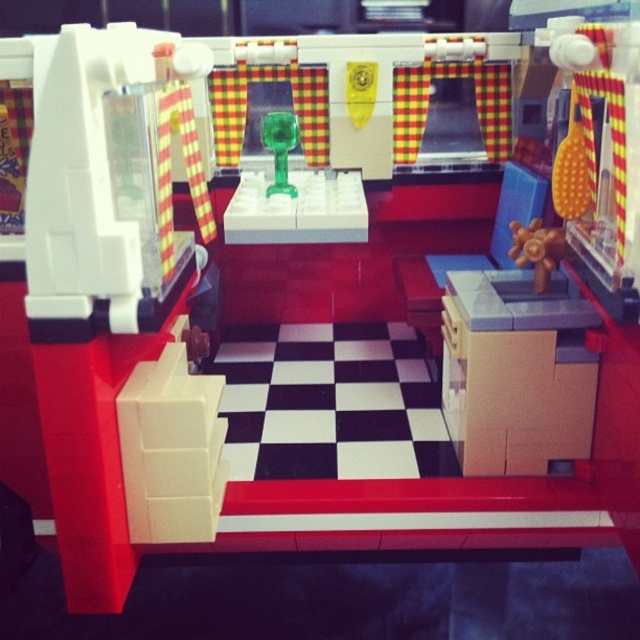
Does wooden fan at center right have a lesser height compared to green translucent plastic cup at center?

Correct, wooden fan at center right is not as tall as green translucent plastic cup at center.

Can you confirm if wooden fan at center right is positioned below green translucent plastic cup at center?

Correct, wooden fan at center right is located below green translucent plastic cup at center.

Image resolution: width=640 pixels, height=640 pixels. What do you see at coordinates (536, 250) in the screenshot?
I see `wooden fan at center right` at bounding box center [536, 250].

Locate an element on the screen. The width and height of the screenshot is (640, 640). wooden fan at center right is located at coordinates (536, 250).